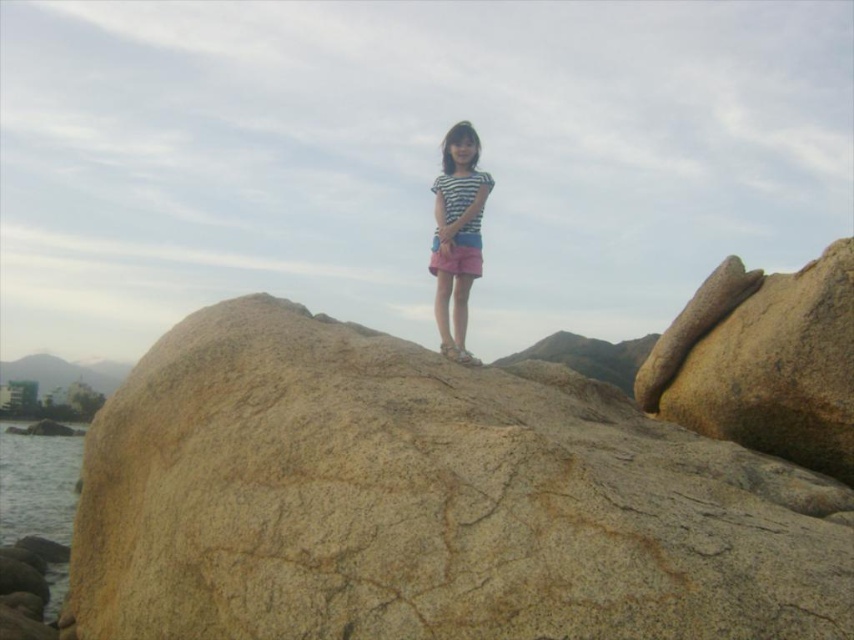
You are a photographer aiming to capture the striped fabric shorts at center and the clear water at lower left in the same frame. Based on their positions, which object is closer to the left side of the image?

The clear water at lower left is closer to the left side of the image since the striped fabric shorts at center is to the right of it.

You are a photographer planning to take a picture of the scene described. You notice two points marked in the image. The first point is at coordinate point (699, 465), and the second is at point (20, 472). From your position, which point is closer to you?

Point (699, 465) is in front of point (20, 472), so it is closer to you.